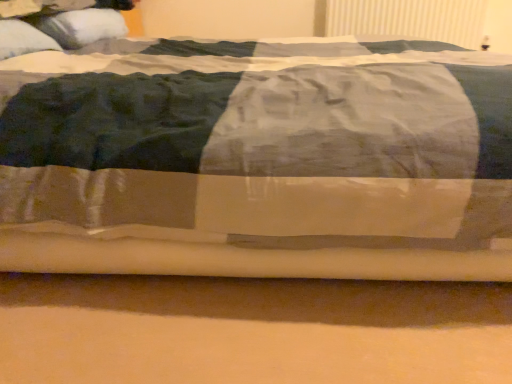
What do you see at coordinates (81, 26) in the screenshot? I see `white soft pillow at upper left, which appears as the 2th pillow when viewed from the front` at bounding box center [81, 26].

Find the location of `white soft pillow at upper left, the first pillow from the front`. white soft pillow at upper left, the first pillow from the front is located at coordinates (23, 39).

From the image's perspective, is white soft pillow at upper left, marked as the 1th pillow in a back-to-front arrangement, positioned above or below white soft pillow at upper left, which appears as the second pillow when viewed from the back?

white soft pillow at upper left, marked as the 1th pillow in a back-to-front arrangement, is above white soft pillow at upper left, which appears as the second pillow when viewed from the back.

Which object is closer to the camera, white soft pillow at upper left, marked as the 1th pillow in a back-to-front arrangement, or white soft pillow at upper left, the first pillow from the front?

white soft pillow at upper left, the first pillow from the front, is more forward.

What's the angular difference between white soft pillow at upper left, which appears as the 2th pillow when viewed from the front, and white soft pillow at upper left, the first pillow from the front,'s facing directions?

5.31 degrees separate the facing orientations of white soft pillow at upper left, which appears as the 2th pillow when viewed from the front, and white soft pillow at upper left, the first pillow from the front.

Are white soft pillow at upper left, marked as the 1th pillow in a back-to-front arrangement, and white soft pillow at upper left, which appears as the second pillow when viewed from the back, making contact?

white soft pillow at upper left, marked as the 1th pillow in a back-to-front arrangement, and white soft pillow at upper left, which appears as the second pillow when viewed from the back, are clearly separated.

Considering the positions of objects white soft pillow at upper left, the first pillow from the front, and white soft pillow at upper left, which appears as the 2th pillow when viewed from the front, in the image provided, who is behind, white soft pillow at upper left, the first pillow from the front, or white soft pillow at upper left, which appears as the 2th pillow when viewed from the front,?

white soft pillow at upper left, which appears as the 2th pillow when viewed from the front, is further from the camera.

Is white soft pillow at upper left, the first pillow from the front, next to white soft pillow at upper left, which appears as the 2th pillow when viewed from the front?

No, white soft pillow at upper left, the first pillow from the front, is not in contact with white soft pillow at upper left, which appears as the 2th pillow when viewed from the front.

Looking at this image, would you say white soft pillow at upper left, the first pillow from the front, is outside white soft pillow at upper left, marked as the 1th pillow in a back-to-front arrangement?

Indeed, white soft pillow at upper left, the first pillow from the front, is completely outside white soft pillow at upper left, marked as the 1th pillow in a back-to-front arrangement.

Is white soft pillow at upper left, marked as the 1th pillow in a back-to-front arrangement, turned away from white textured radiator at upper right?

No.

Is white soft pillow at upper left, which appears as the 2th pillow when viewed from the front, positioned far away from white textured radiator at upper right?

white soft pillow at upper left, which appears as the 2th pillow when viewed from the front, is far away from white textured radiator at upper right.

Is white soft pillow at upper left, marked as the 1th pillow in a back-to-front arrangement, situated inside white textured radiator at upper right or outside?

A: white soft pillow at upper left, marked as the 1th pillow in a back-to-front arrangement, is not inside white textured radiator at upper right, it's outside.

Who is bigger, white soft pillow at upper left, which appears as the second pillow when viewed from the back, or white textured radiator at upper right?

white textured radiator at upper right is bigger.

In the scene shown: Is white soft pillow at upper left, the first pillow from the front, positioned far away from white textured radiator at upper right?

Yes, white soft pillow at upper left, the first pillow from the front, and white textured radiator at upper right are located far from each other.

Is white textured radiator at upper right at the back of white soft pillow at upper left, which appears as the second pillow when viewed from the back?

No, white textured radiator at upper right is not at the back of white soft pillow at upper left, which appears as the second pillow when viewed from the back.

Find the location of a particular element. This screenshot has height=384, width=512. pillow that is the 2nd one when counting leftward from the white textured radiator at upper right is located at coordinates (81, 26).

Could you tell me if white textured radiator at upper right is turned towards white soft pillow at upper left, marked as the 1th pillow in a back-to-front arrangement?

No, white textured radiator at upper right is not facing towards white soft pillow at upper left, marked as the 1th pillow in a back-to-front arrangement.

Considering the positions of point (467, 3) and point (70, 40), is point (467, 3) closer or farther from the camera than point (70, 40)?

Point (467, 3) appears to be farther away from the viewer than point (70, 40).

Are white textured radiator at upper right and white soft pillow at upper left, which appears as the second pillow when viewed from the back, beside each other?

white textured radiator at upper right and white soft pillow at upper left, which appears as the second pillow when viewed from the back, are clearly separated.

From a real-world perspective, is white textured radiator at upper right physically located above or below white soft pillow at upper left, which appears as the second pillow when viewed from the back?

Clearly, from a real-world perspective, white textured radiator at upper right is above white soft pillow at upper left, which appears as the second pillow when viewed from the back.

Which is farther from the camera, (x=444, y=29) or (x=37, y=32)?

The point (x=444, y=29) is farther from the camera.

Locate an element on the screen. radiator above the white soft pillow at upper left, the first pillow from the front (from a real-world perspective) is located at coordinates (409, 19).

Where is `pillow below the white soft pillow at upper left, which appears as the 2th pillow when viewed from the front (from a real-world perspective)`? pillow below the white soft pillow at upper left, which appears as the 2th pillow when viewed from the front (from a real-world perspective) is located at coordinates (23, 39).

In order to click on pillow above the white soft pillow at upper left, the first pillow from the front (from a real-world perspective) in this screenshot , I will do `click(81, 26)`.

Based on their spatial positions, is white textured radiator at upper right or white soft pillow at upper left, the first pillow from the front, further from white soft pillow at upper left, which appears as the 2th pillow when viewed from the front?

white textured radiator at upper right is further to white soft pillow at upper left, which appears as the 2th pillow when viewed from the front.

Which object lies further to the anchor point white soft pillow at upper left, the first pillow from the front, white textured radiator at upper right or white soft pillow at upper left, marked as the 1th pillow in a back-to-front arrangement?

The object further to white soft pillow at upper left, the first pillow from the front, is white textured radiator at upper right.

Based on their spatial positions, is white soft pillow at upper left, marked as the 1th pillow in a back-to-front arrangement, or white textured radiator at upper right further from white soft pillow at upper left, the first pillow from the front?

The object further to white soft pillow at upper left, the first pillow from the front, is white textured radiator at upper right.

Considering their positions, is white soft pillow at upper left, the first pillow from the front, positioned further to white textured radiator at upper right than white soft pillow at upper left, which appears as the 2th pillow when viewed from the front?

white soft pillow at upper left, the first pillow from the front.

Considering their positions, is white soft pillow at upper left, marked as the 1th pillow in a back-to-front arrangement, positioned closer to white textured radiator at upper right than white soft pillow at upper left, which appears as the second pillow when viewed from the back?

white soft pillow at upper left, marked as the 1th pillow in a back-to-front arrangement.

Looking at the image, which one is located closer to white soft pillow at upper left, marked as the 1th pillow in a back-to-front arrangement, white soft pillow at upper left, which appears as the second pillow when viewed from the back, or white textured radiator at upper right?

The object closer to white soft pillow at upper left, marked as the 1th pillow in a back-to-front arrangement, is white soft pillow at upper left, which appears as the second pillow when viewed from the back.

Locate an element on the screen. The image size is (512, 384). pillow situated between white soft pillow at upper left, marked as the 1th pillow in a back-to-front arrangement, and white textured radiator at upper right from left to right is located at coordinates (23, 39).